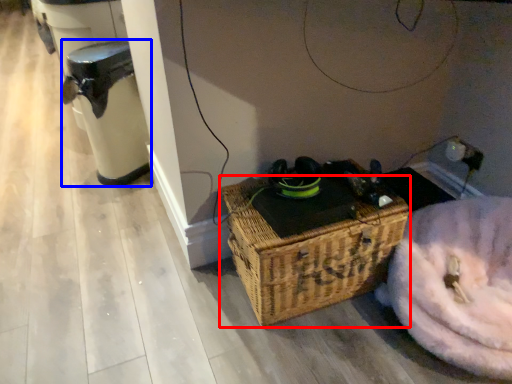
Question: Which object is further to the camera taking this photo, picnic basket (highlighted by a red box) or water heater (highlighted by a blue box)?

Choices:
 (A) picnic basket
 (B) water heater

Answer: (B)